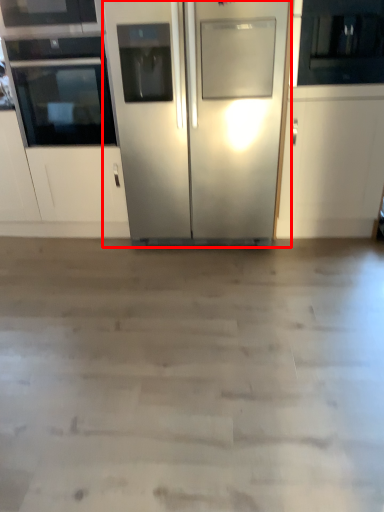
Question: From the image's perspective, where is refrigerator (annotated by the red box) located in relation to oven in the image?

Choices:
 (A) below
 (B) above

Answer: (A)